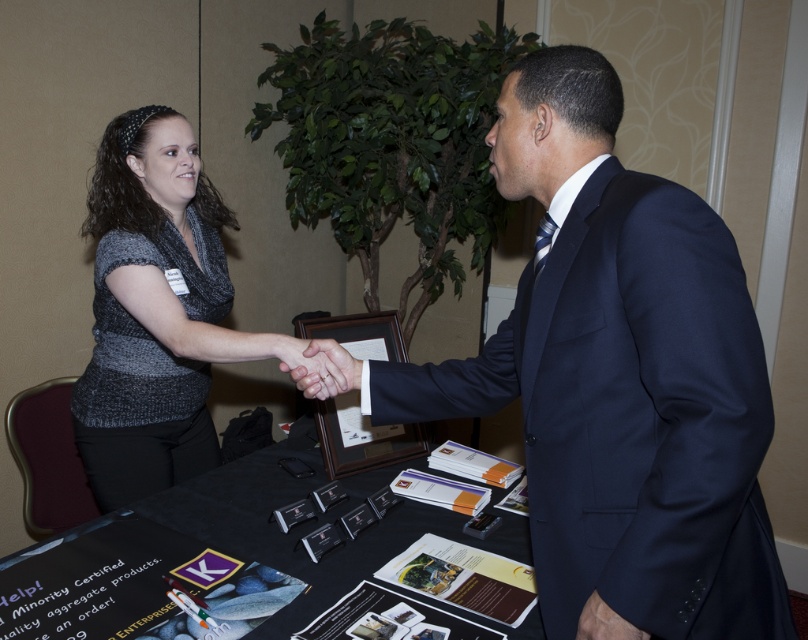
Question: Which point is farther to the camera?

Choices:
 (A) black paper at center
 (B) dark blue suit at center
 (C) knit sweater at center

Answer: (C)

Question: Is dark blue suit at center behind black paper at center?

Choices:
 (A) yes
 (B) no

Answer: (B)

Question: Is dark blue suit at center to the right of dark blue fabric at lower right from the viewer's perspective?

Choices:
 (A) yes
 (B) no

Answer: (B)

Question: Can you confirm if knit sweater at center is smaller than dark blue fabric at lower right?

Choices:
 (A) no
 (B) yes

Answer: (A)

Question: Which object is the closest to the black paper at center?

Choices:
 (A) dark blue fabric at lower right
 (B) dark blue suit at center
 (C) knit sweater at center

Answer: (C)

Question: Estimate the real-world distances between objects in this image. Which object is farther from the dark blue suit at center?

Choices:
 (A) dark blue fabric at lower right
 (B) knit sweater at center
 (C) black paper at center
 (D) smooth skin handshake at center

Answer: (B)